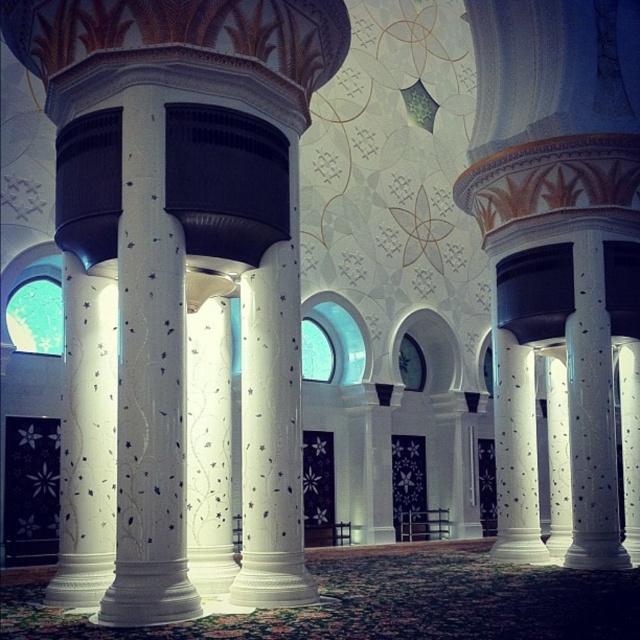
Question: Which point is farther to the camera?

Choices:
 (A) (90, 288)
 (B) (140, 481)

Answer: (A)

Question: Does white glossy column at center lie behind white textured column at center?

Choices:
 (A) no
 (B) yes

Answer: (A)

Question: Among these objects, which one is nearest to the camera?

Choices:
 (A) white speckled marble column at right
 (B) white textured column at center

Answer: (B)

Question: Does white glossy column at center lie behind white textured column at center?

Choices:
 (A) no
 (B) yes

Answer: (A)

Question: Does white glossy column at center come in front of white textured column at center?

Choices:
 (A) no
 (B) yes

Answer: (B)

Question: Among these objects, which one is nearest to the camera?

Choices:
 (A) white speckled marble column at right
 (B) white glossy column at center

Answer: (B)